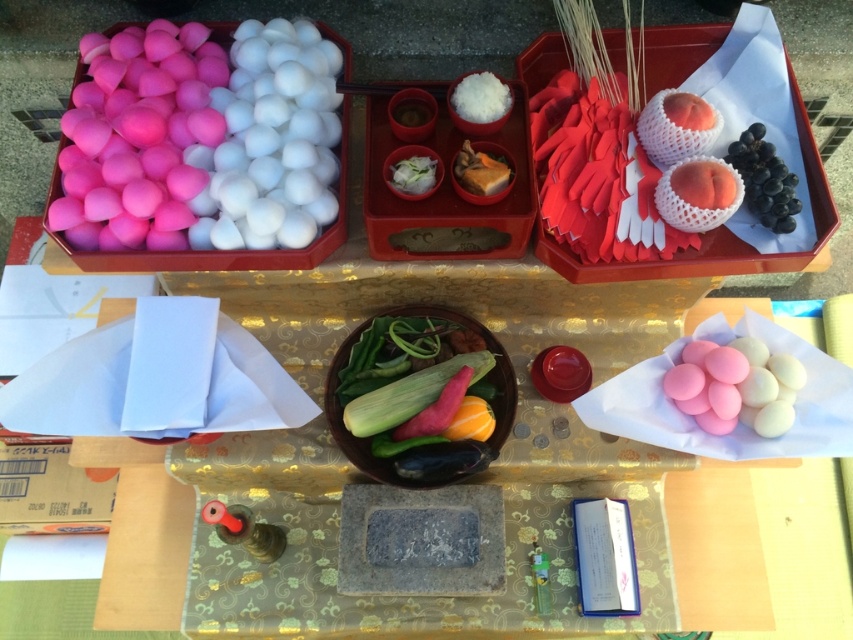
Between pink matte ping pong balls at upper left and white fluffy rice at upper center, which one has less height?

Standing shorter between the two is white fluffy rice at upper center.

Does pink matte ping pong balls at upper left have a greater height compared to white fluffy rice at upper center?

Yes, pink matte ping pong balls at upper left is taller than white fluffy rice at upper center.

Is point (268, 196) positioned in front of point (482, 106)?

No, (268, 196) is behind (482, 106).

The width and height of the screenshot is (853, 640). Find the location of `pink matte ping pong balls at upper left`. pink matte ping pong balls at upper left is located at coordinates (276, 140).

Between pink matte candy at lower right and black glossy grapes at upper right, which one has less height?

pink matte candy at lower right

Measure the distance between pink matte candy at lower right and black glossy grapes at upper right.

They are 7.60 inches apart.

Where is `pink matte candy at lower right`? The image size is (853, 640). pink matte candy at lower right is located at coordinates (735, 385).

Can you confirm if pink matte candy at lower right is wider than white glossy bowl at center?

Correct, the width of pink matte candy at lower right exceeds that of white glossy bowl at center.

Can you confirm if pink matte candy at lower right is thinner than white glossy bowl at center?

No.

Find the location of a particular element. The height and width of the screenshot is (640, 853). pink matte candy at lower right is located at coordinates (735, 385).